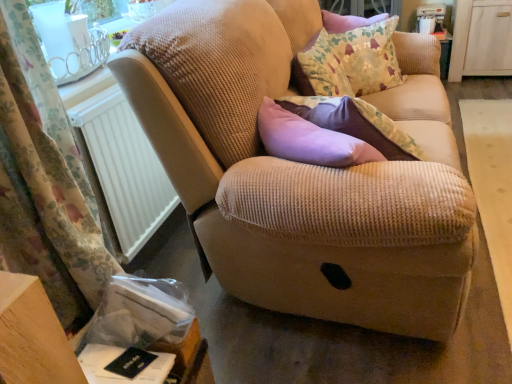
Question: Is floral fabric cushion at upper right next to white wood dresser at upper right and touching it?

Choices:
 (A) yes
 (B) no

Answer: (B)

Question: From the image's perspective, would you say floral fabric cushion at upper right is positioned over white wood dresser at upper right?

Choices:
 (A) no
 (B) yes

Answer: (A)

Question: Is floral fabric cushion at upper right positioned with its back to white wood dresser at upper right?

Choices:
 (A) yes
 (B) no

Answer: (B)

Question: Is floral fabric cushion at upper right bigger than white wood dresser at upper right?

Choices:
 (A) yes
 (B) no

Answer: (B)

Question: Considering the relative sizes of floral fabric cushion at upper right and white wood dresser at upper right in the image provided, is floral fabric cushion at upper right thinner than white wood dresser at upper right?

Choices:
 (A) yes
 (B) no

Answer: (A)

Question: Would you consider floral fabric cushion at upper right to be distant from white wood dresser at upper right?

Choices:
 (A) no
 (B) yes

Answer: (B)

Question: Are white plastic radiator at left and white wood dresser at upper right located far from each other?

Choices:
 (A) no
 (B) yes

Answer: (B)

Question: Does white plastic radiator at left appear on the left side of white wood dresser at upper right?

Choices:
 (A) no
 (B) yes

Answer: (B)

Question: Is white wood dresser at upper right completely or partially inside white plastic radiator at left?

Choices:
 (A) no
 (B) yes

Answer: (A)

Question: Is white plastic radiator at left facing away from white wood dresser at upper right?

Choices:
 (A) no
 (B) yes

Answer: (A)

Question: From a real-world perspective, is white plastic radiator at left on top of white wood dresser at upper right?

Choices:
 (A) no
 (B) yes

Answer: (B)

Question: Can you confirm if white plastic radiator at left is bigger than white wood dresser at upper right?

Choices:
 (A) yes
 (B) no

Answer: (B)

Question: Does white wood dresser at upper right have a smaller size compared to white plastic radiator at left?

Choices:
 (A) yes
 (B) no

Answer: (B)